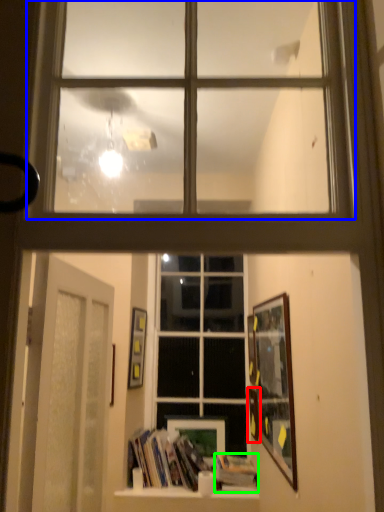
Question: Based on their relative distances, which object is farther from picture frame (highlighted by a red box)? Choose from window (highlighted by a blue box) and paperback book (highlighted by a green box).

Choices:
 (A) window
 (B) paperback book

Answer: (A)